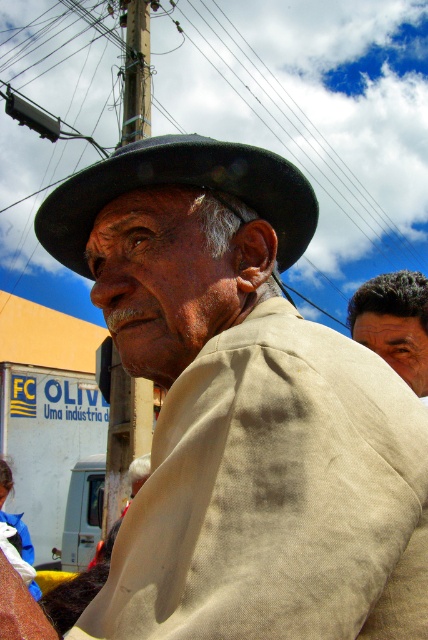
Question: Is matte beige jacket at center smaller than black wire at upper center?

Choices:
 (A) yes
 (B) no

Answer: (A)

Question: Among these points, which one is farthest from the camera?

Choices:
 (A) (133, 67)
 (B) (186, 22)
 (C) (293, 211)

Answer: (B)

Question: Which point is farther to the camera?

Choices:
 (A) black wire at upper center
 (B) dark brown hair at upper right

Answer: (A)

Question: Is dark brown hair at upper right above brown wooden pole at upper center?

Choices:
 (A) no
 (B) yes

Answer: (A)

Question: Among these points, which one is nearest to the camera?

Choices:
 (A) (124, 180)
 (B) (139, 22)
 (C) (392, 122)
 (D) (382, 336)

Answer: (A)

Question: Is black felt fedora at center wider than dark brown hair at upper right?

Choices:
 (A) no
 (B) yes

Answer: (B)